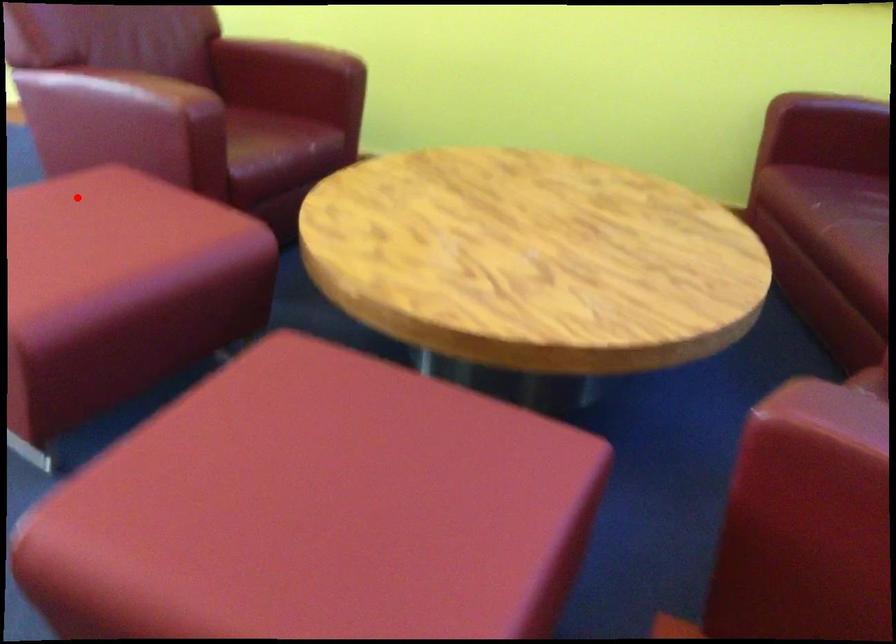
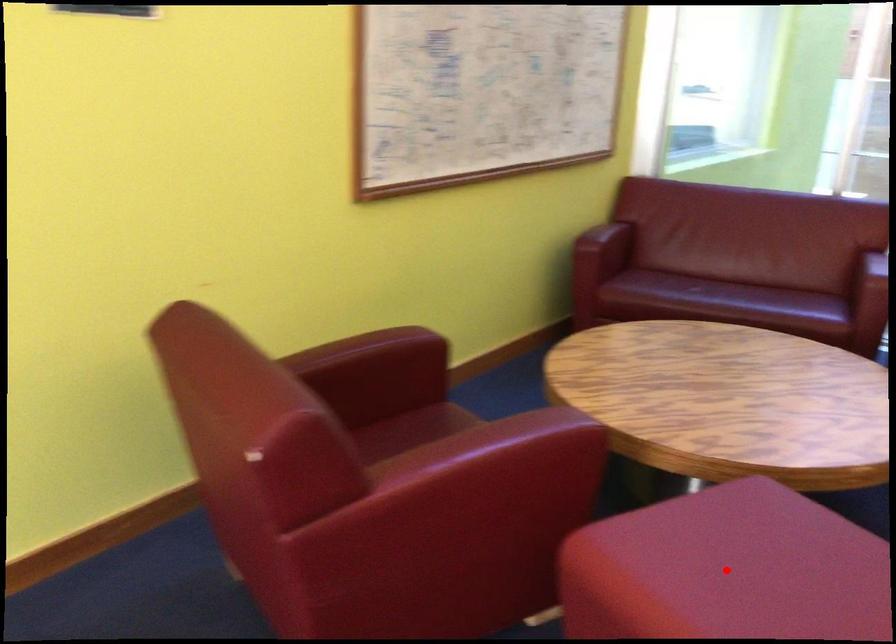
I am providing you with two images of the same scene from different viewpoints. A red point is marked on the first image and another point is marked on the second image. Do the highlighted points in image1 and image2 indicate the same real-world spot?

Yes